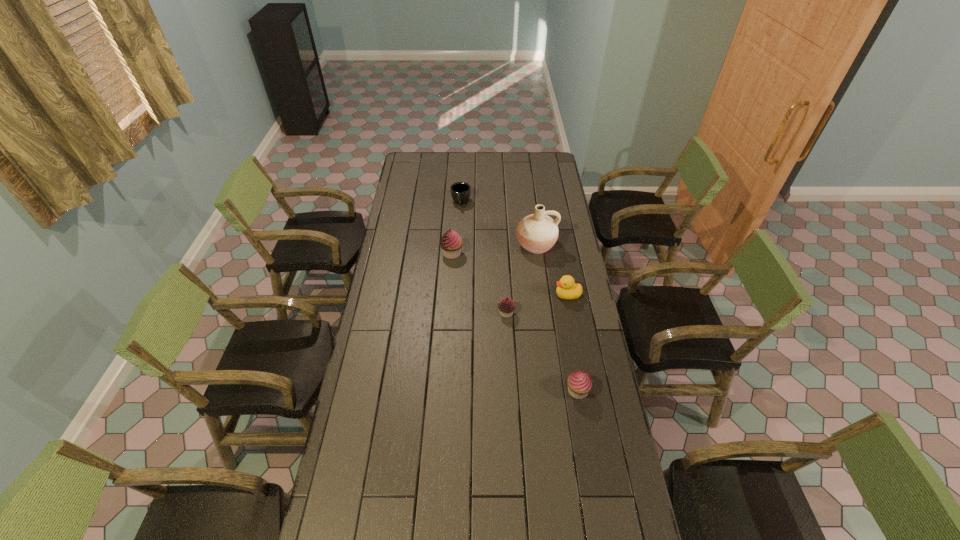
I want to click on free point that keeps the cupcakes evenly spaced on the left, so click(410, 207).